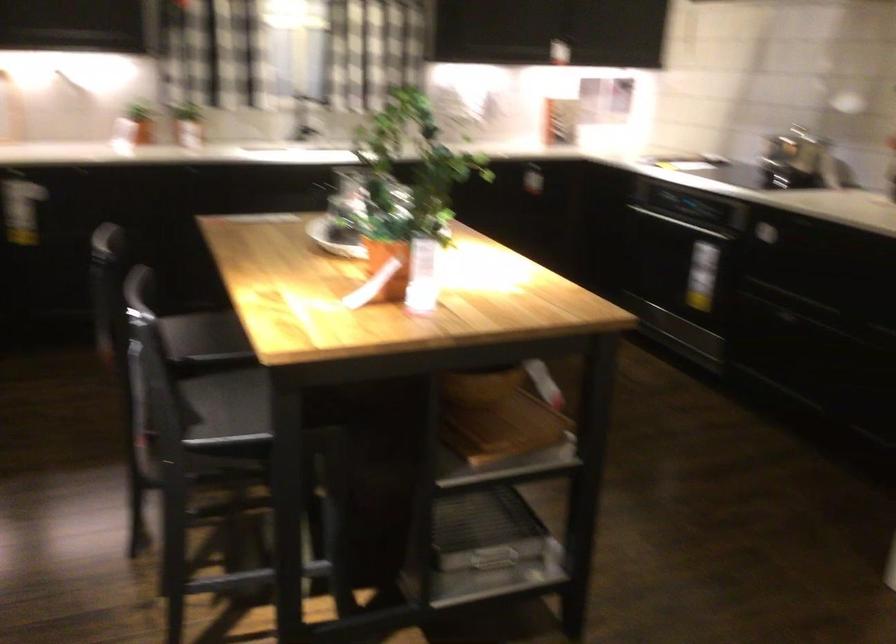
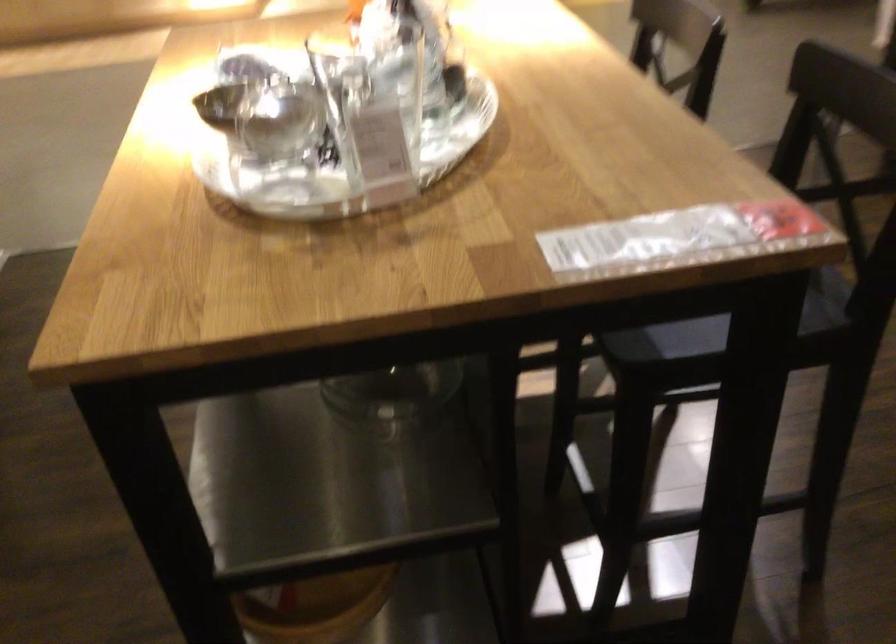
The point at (225, 223) is marked in the first image. Where is the corresponding point in the second image?

(676, 238)